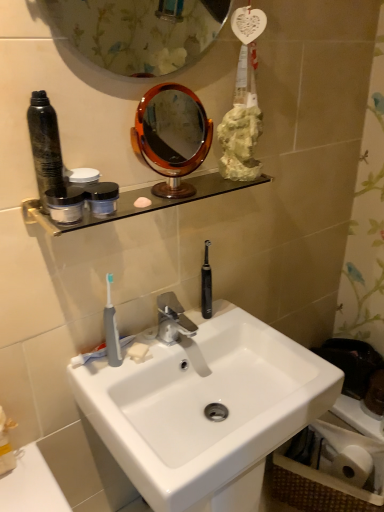
Identify the location of space that is in front of black rubber toothbrush at center, the 2th toothbrush when ordered from front to back. The width and height of the screenshot is (384, 512). (204, 335).